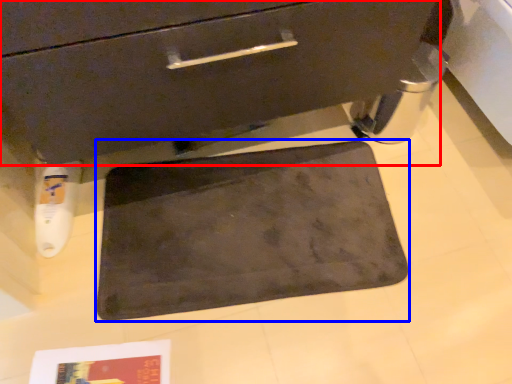
Question: Which object is further to the camera taking this photo, drawer (highlighted by a red box) or bath mat (highlighted by a blue box)?

Choices:
 (A) drawer
 (B) bath mat

Answer: (B)